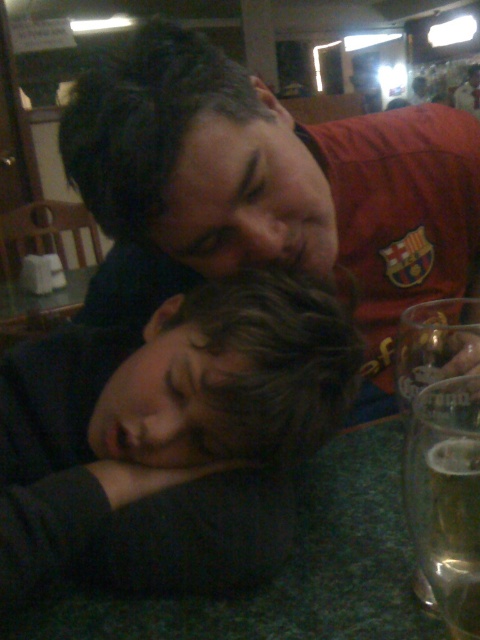
Measure the distance between matte red shirt at center and clear glass beer at lower right.

They are 9.69 inches apart.

Is point (423, 196) positioned in front of point (454, 412)?

No.

Identify the location of matte red shirt at center. The height and width of the screenshot is (640, 480). (266, 192).

What do you see at coordinates (168, 436) in the screenshot? Image resolution: width=480 pixels, height=640 pixels. I see `dark brown hair at lower left` at bounding box center [168, 436].

Can you confirm if dark brown hair at lower left is smaller than matte red shirt at center?

Yes, dark brown hair at lower left is smaller than matte red shirt at center.

Who is more forward, (252, 506) or (279, 259)?

Positioned in front is point (252, 506).

The height and width of the screenshot is (640, 480). Find the location of `dark brown hair at lower left`. dark brown hair at lower left is located at coordinates (168, 436).

Does dark brown hair at lower left have a lesser height compared to clear glass beer at lower right?

No, dark brown hair at lower left is not shorter than clear glass beer at lower right.

Does point (134, 516) come closer to viewer compared to point (472, 531)?

No.

Is point (11, 392) positioned behind point (430, 563)?

Yes.

This screenshot has width=480, height=640. Identify the location of dark brown hair at lower left. (168, 436).